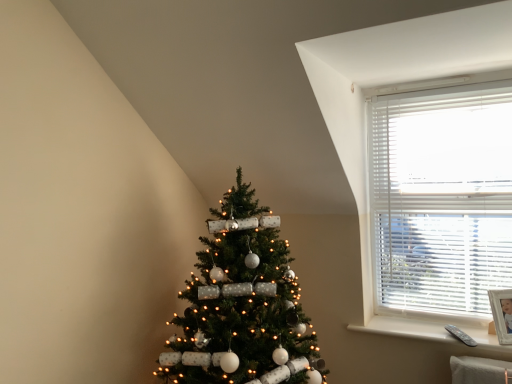
Question: From a real-world perspective, does white plastic remote at lower right sit lower than green matte christmas tree at center?

Choices:
 (A) no
 (B) yes

Answer: (B)

Question: From the image's perspective, would you say white plastic remote at lower right is positioned over green matte christmas tree at center?

Choices:
 (A) yes
 (B) no

Answer: (B)

Question: Is white plastic remote at lower right facing away from green matte christmas tree at center?

Choices:
 (A) yes
 (B) no

Answer: (B)

Question: Would you consider white plastic remote at lower right to be distant from green matte christmas tree at center?

Choices:
 (A) yes
 (B) no

Answer: (B)

Question: From a real-world perspective, is white plastic remote at lower right located higher than green matte christmas tree at center?

Choices:
 (A) no
 (B) yes

Answer: (A)

Question: Is white plastic remote at lower right to the left of green matte christmas tree at center from the viewer's perspective?

Choices:
 (A) yes
 (B) no

Answer: (B)

Question: Considering the relative sizes of white blinds at upper right and green matte christmas tree at center in the image provided, is white blinds at upper right smaller than green matte christmas tree at center?

Choices:
 (A) yes
 (B) no

Answer: (A)

Question: Are white blinds at upper right and green matte christmas tree at center far apart?

Choices:
 (A) no
 (B) yes

Answer: (A)

Question: Does white blinds at upper right appear on the right side of green matte christmas tree at center?

Choices:
 (A) yes
 (B) no

Answer: (A)

Question: Is white blinds at upper right positioned in front of green matte christmas tree at center?

Choices:
 (A) yes
 (B) no

Answer: (B)

Question: Is white blinds at upper right completely or partially outside of green matte christmas tree at center?

Choices:
 (A) yes
 (B) no

Answer: (A)

Question: Can you confirm if white blinds at upper right is shorter than green matte christmas tree at center?

Choices:
 (A) no
 (B) yes

Answer: (B)

Question: Is green matte christmas tree at center to the right of white blinds at upper right from the viewer's perspective?

Choices:
 (A) no
 (B) yes

Answer: (A)